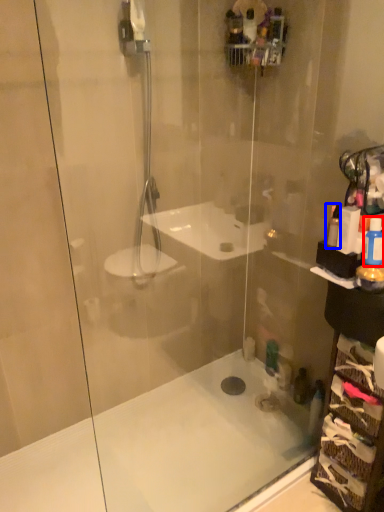
Question: Which point is further to the camera, toiletry (highlighted by a red box) or toiletry (highlighted by a blue box)?

Choices:
 (A) toiletry
 (B) toiletry

Answer: (B)